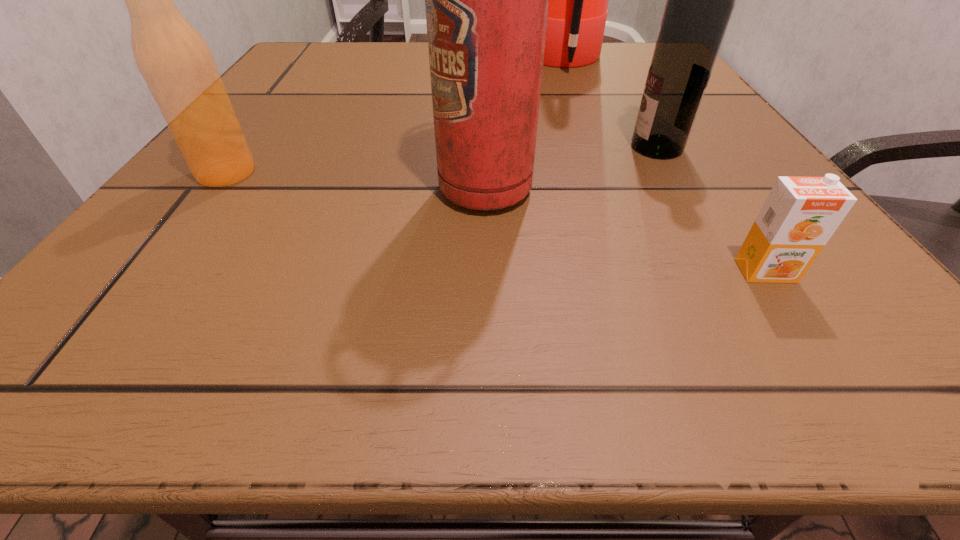
The height and width of the screenshot is (540, 960). Identify the location of object that is at the far edge. (578, 0).

Where is `object that is at the left edge`? object that is at the left edge is located at coordinates (178, 67).

The image size is (960, 540). I want to click on fire extinguisher that is at the right edge, so click(x=578, y=0).

Locate an element on the screen. The height and width of the screenshot is (540, 960). alcohol located in the right edge section of the desktop is located at coordinates (700, 0).

Identify the location of orange juice at the right edge. (800, 214).

Locate an element on the screen. The image size is (960, 540). object at the far right corner is located at coordinates (578, 0).

The width and height of the screenshot is (960, 540). In order to click on vacant space at the far edge in this screenshot , I will do `click(381, 66)`.

The image size is (960, 540). In order to click on vacant area at the near edge of the desktop in this screenshot , I will do `click(252, 335)`.

The width and height of the screenshot is (960, 540). I want to click on blank space at the left edge of the desktop, so click(x=289, y=193).

Image resolution: width=960 pixels, height=540 pixels. Identify the location of free space at the right edge. (728, 119).